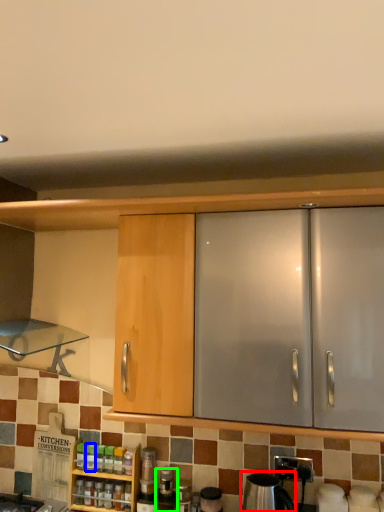
Question: Which object is the farthest from appliance (highlighted by a red box)? Choose among these: bottle (highlighted by a blue box) or bottle (highlighted by a green box).

Choices:
 (A) bottle
 (B) bottle

Answer: (A)